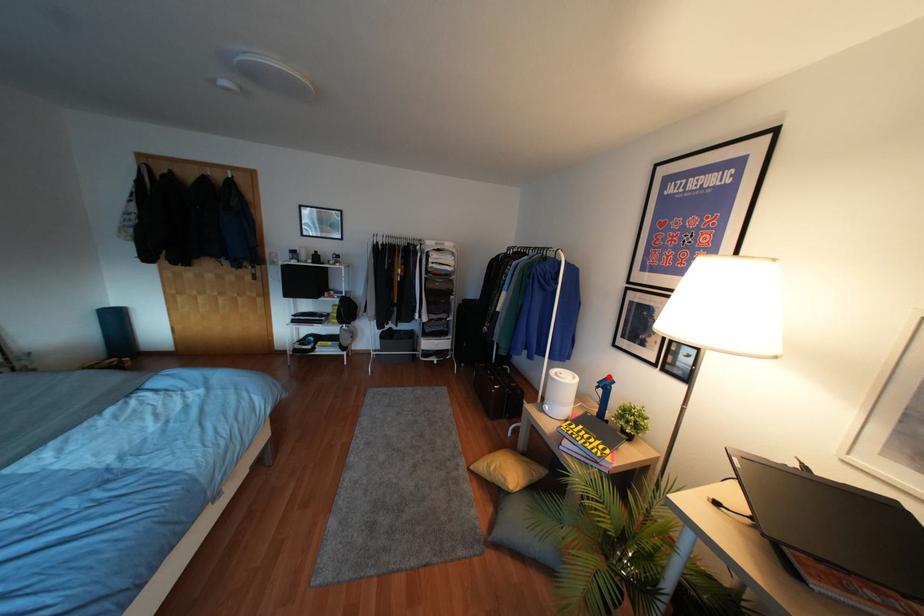
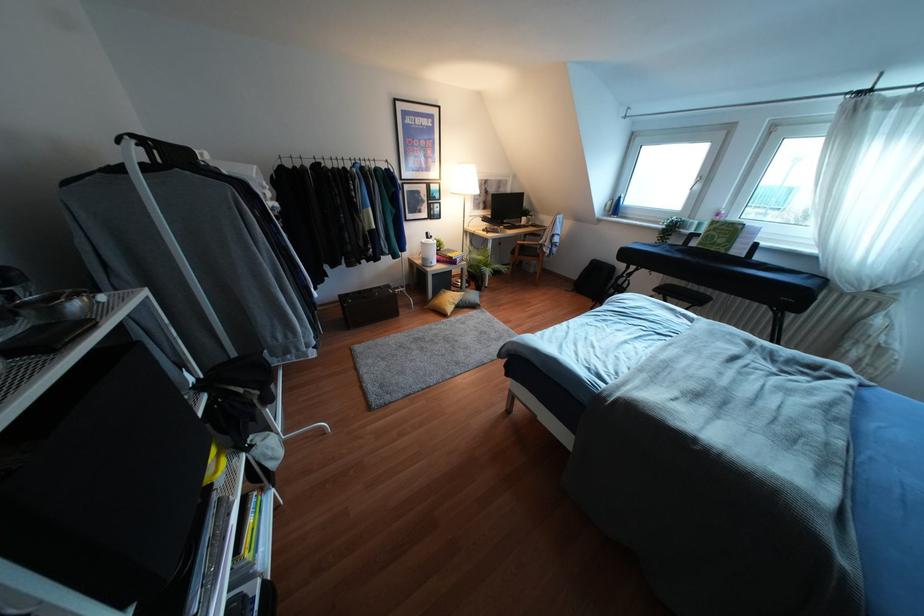
Question: I am providing you with two images of the same scene from different viewpoints. In image1, a red point is highlighted. Considering the same 3D point in image2, which of the following is correct?

Choices:
 (A) It is closer
 (B) It is farther

Answer: (A)